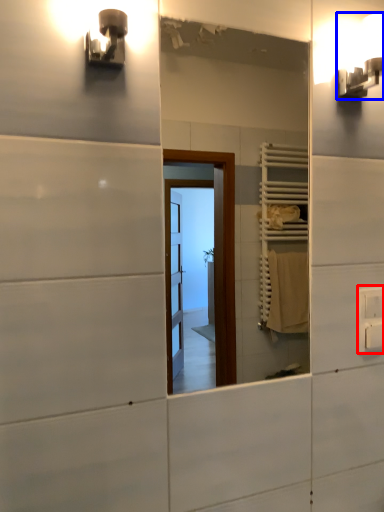
Question: Which of the following is the farthest to the observer, electric outlet (highlighted by a red box) or light fixture (highlighted by a blue box)?

Choices:
 (A) electric outlet
 (B) light fixture

Answer: (A)